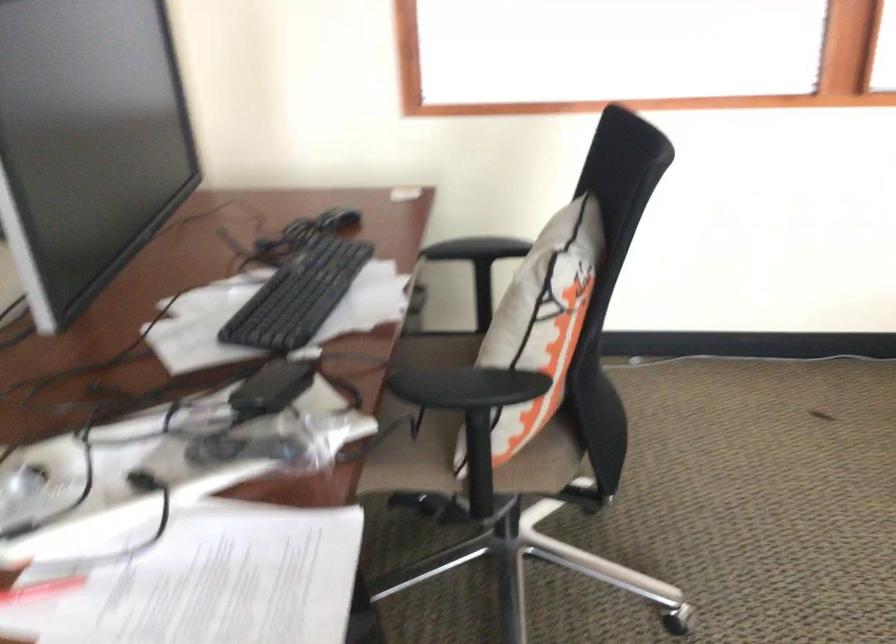
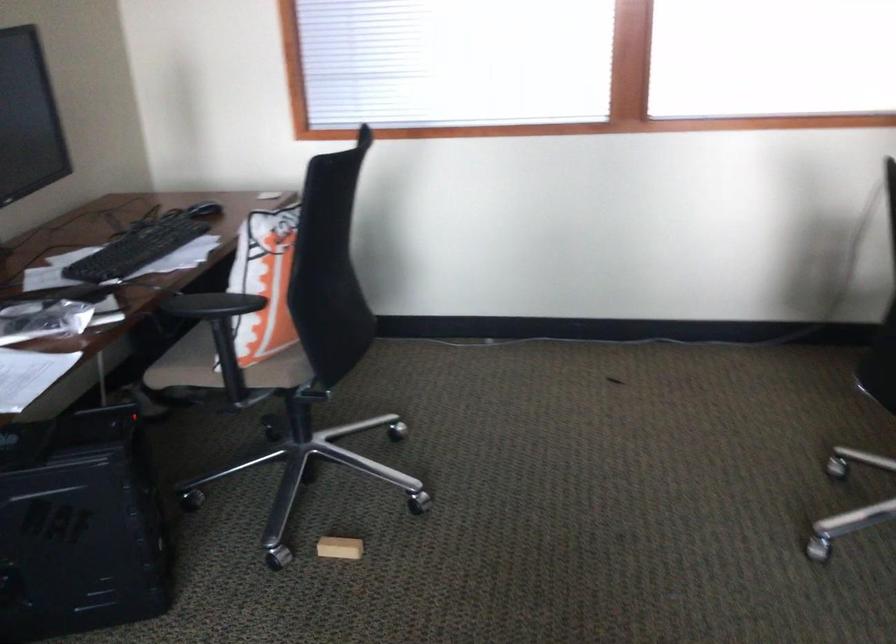
The point at (347, 221) is marked in the first image. Where is the corresponding point in the second image?

(204, 210)